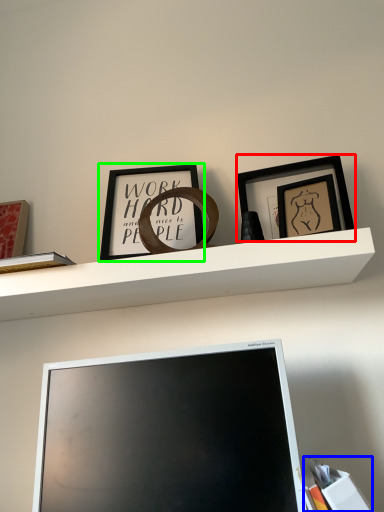
Question: Which is farther away from picture frame (highlighted by a red box)? book (highlighted by a blue box) or picture frame (highlighted by a green box)?

Choices:
 (A) book
 (B) picture frame

Answer: (A)